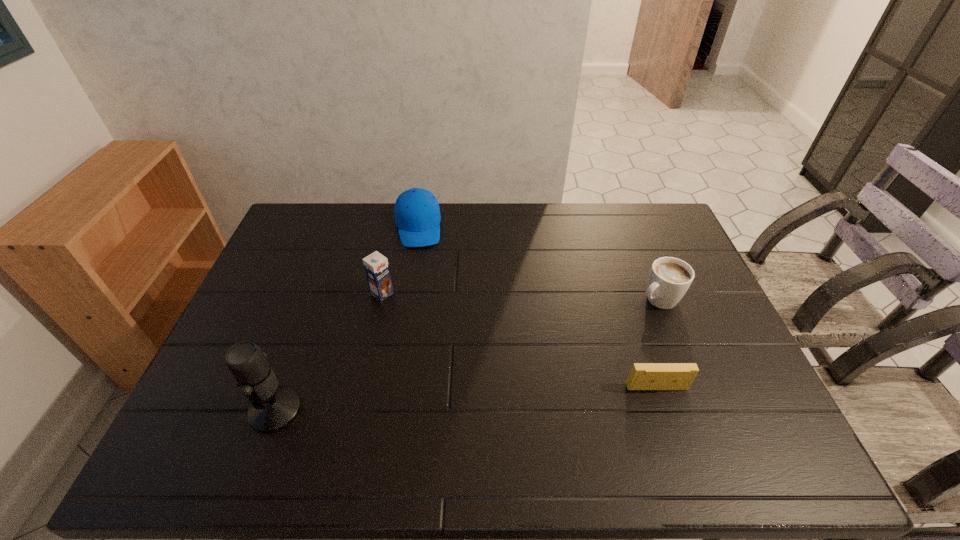
The image size is (960, 540). Find the location of `microphone`. microphone is located at coordinates (273, 407).

Locate an element on the screen. The width and height of the screenshot is (960, 540). the tallest object is located at coordinates (273, 407).

This screenshot has width=960, height=540. Identify the location of the shortest object. (643, 376).

What are the coordinates of `the fourth shortest object` in the screenshot? It's located at (376, 265).

Find the location of `cap`. cap is located at coordinates (417, 214).

Find the location of a particular element. Image resolution: width=960 pixels, height=540 pixels. cappuccino is located at coordinates (669, 279).

Find the location of a particular element. Image resolution: width=960 pixels, height=540 pixels. free space located on the side of the tallest object with the red ring is located at coordinates (193, 410).

I want to click on free space located at the front of the videotape with spools, so click(x=668, y=421).

This screenshot has height=540, width=960. What are the coordinates of `free space located 0.290m on the front label of the fourth shortest object` in the screenshot? It's located at (458, 352).

Identify the location of vacant position located 0.110m on the front label of the fourth shortest object. The width and height of the screenshot is (960, 540). (414, 318).